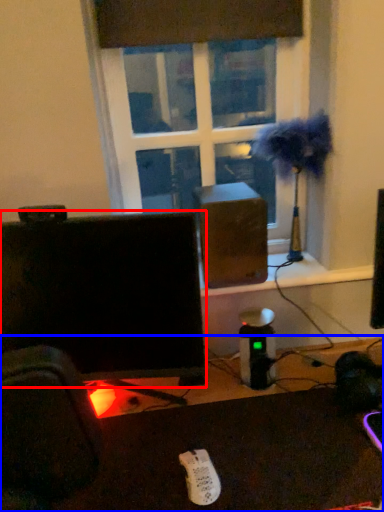
Question: Which of the following is the farthest to the observer, computer monitor (highlighted by a red box) or desk (highlighted by a blue box)?

Choices:
 (A) computer monitor
 (B) desk

Answer: (A)